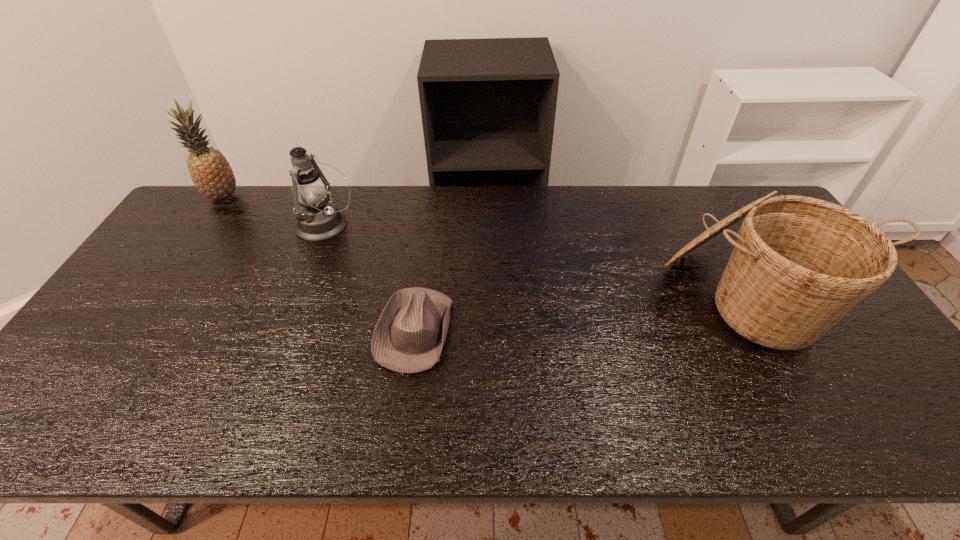
At what (x,y) coordinates should I click in order to perform the action: click on free space between the pineapple and the rightmost object. Please return your answer as a coordinate pair (x, y). This screenshot has width=960, height=540. Looking at the image, I should click on (486, 247).

The height and width of the screenshot is (540, 960). I want to click on empty space that is in between the farthest object and the oil lamp, so click(275, 211).

Locate an element on the screen. This screenshot has height=540, width=960. object that stands as the second closest to the leftmost object is located at coordinates (409, 336).

This screenshot has height=540, width=960. What are the coordinates of `the closest object relative to the fedora` in the screenshot? It's located at (318, 219).

Identify the location of vacant space that satisfies the following two spatial constraints: 1. on the front side of the second object from left to right; 2. on the left side of the rightmost object. (298, 296).

Image resolution: width=960 pixels, height=540 pixels. What are the coordinates of `vacant space that satisfies the following two spatial constraints: 1. on the front side of the rightmost object; 2. on the left side of the farthest object` in the screenshot? It's located at (156, 296).